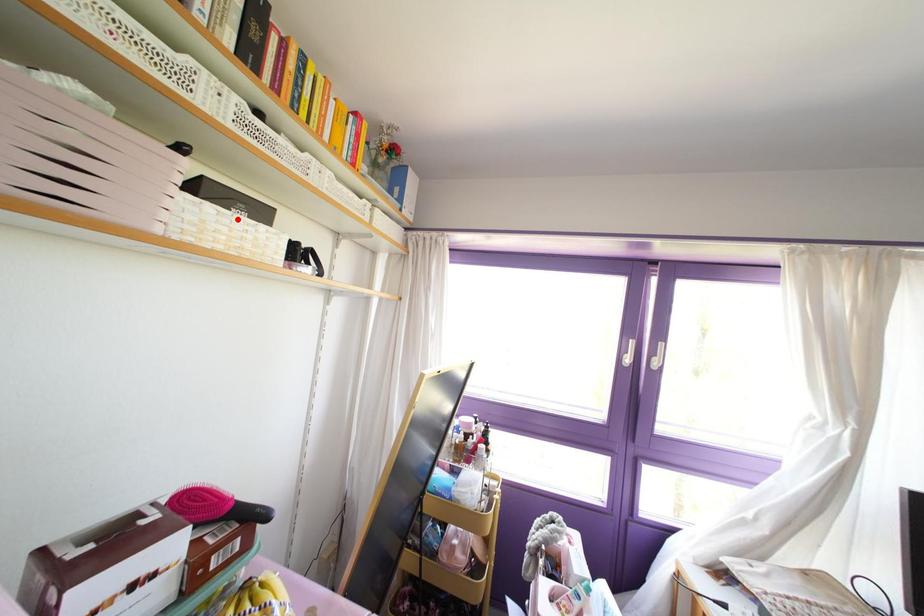
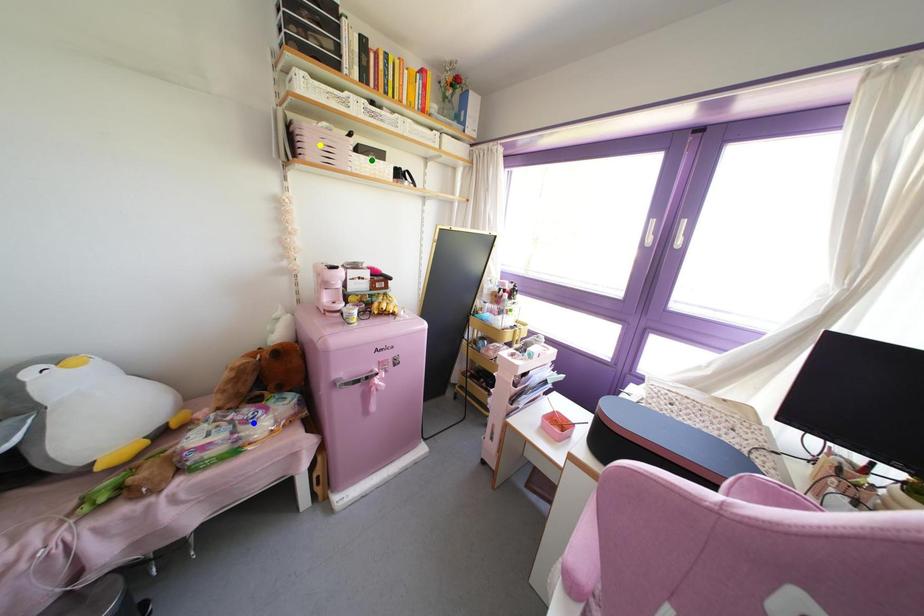
Question: I am providing you with two images of the same scene from different viewpoints. A red point is marked on the first image. You are given multiple points on the second image. Can you choose the point in image 2 that corresponds to the point in image 1?

Choices:
 (A) blue point
 (B) yellow point
 (C) green point

Answer: (C)